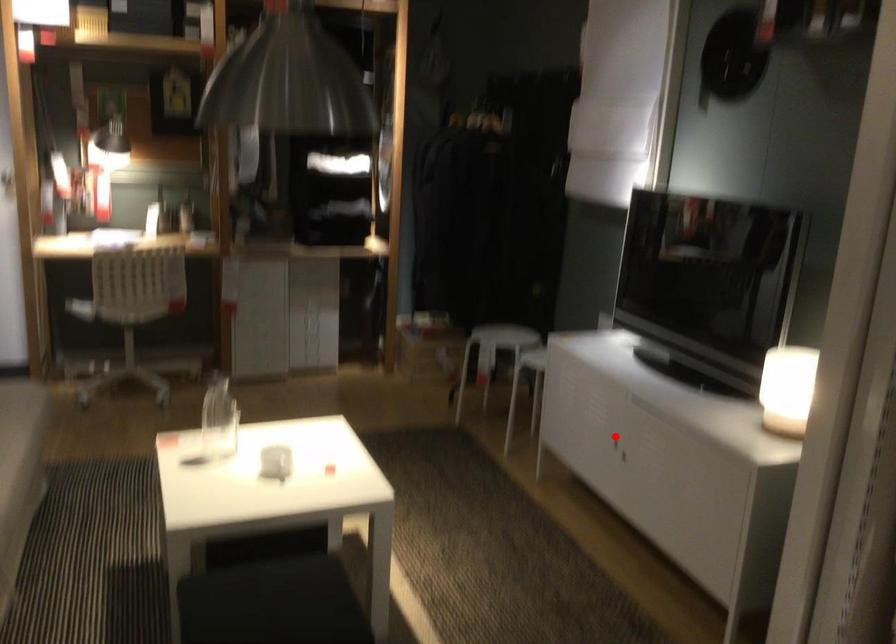
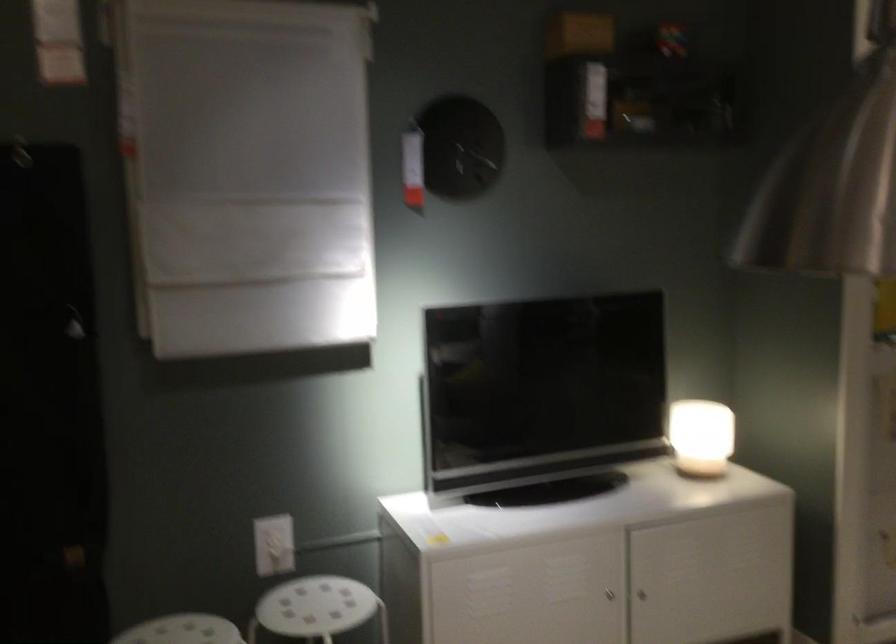
Question: I am providing you with two images of the same scene from different viewpoints. Image1 has a red point marked. In image2, the corresponding 3D location appears at what relative position? Reply with the corresponding letter.

Choices:
 (A) Closer
 (B) Farther

Answer: (A)